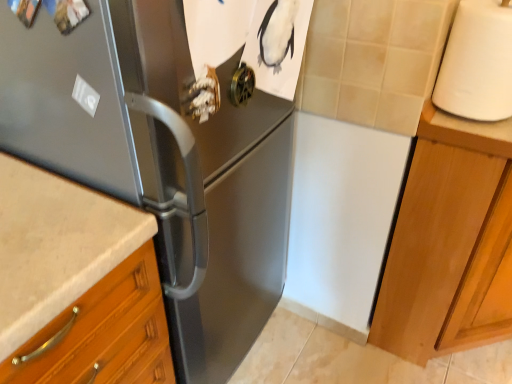
Question: From the image's perspective, is satin black refrigerator at left over light wood cabinet at right?

Choices:
 (A) yes
 (B) no

Answer: (A)

Question: Can you confirm if satin black refrigerator at left is bigger than light wood cabinet at right?

Choices:
 (A) no
 (B) yes

Answer: (B)

Question: Can you confirm if satin black refrigerator at left is wider than light wood cabinet at right?

Choices:
 (A) no
 (B) yes

Answer: (B)

Question: Considering the relative sizes of satin black refrigerator at left and light wood cabinet at right in the image provided, is satin black refrigerator at left thinner than light wood cabinet at right?

Choices:
 (A) no
 (B) yes

Answer: (A)

Question: Is the position of satin black refrigerator at left more distant than that of light wood cabinet at right?

Choices:
 (A) yes
 (B) no

Answer: (B)

Question: Considering the relative positions of light wood cabinet at right and white matte countertop at right in the image provided, is light wood cabinet at right to the left or to the right of white matte countertop at right?

Choices:
 (A) right
 (B) left

Answer: (A)

Question: Looking at their shapes, would you say light wood cabinet at right is wider or thinner than white matte countertop at right?

Choices:
 (A) thin
 (B) wide

Answer: (B)

Question: Based on their sizes in the image, would you say light wood cabinet at right is bigger or smaller than white matte countertop at right?

Choices:
 (A) big
 (B) small

Answer: (A)

Question: From a real-world perspective, is light wood cabinet at right positioned above or below white matte countertop at right?

Choices:
 (A) below
 (B) above

Answer: (A)

Question: In terms of height, does white matte paper towel at right look taller or shorter compared to light wood cabinet at right?

Choices:
 (A) short
 (B) tall

Answer: (A)

Question: Considering their positions, is white matte paper towel at right located in front of or behind light wood cabinet at right?

Choices:
 (A) behind
 (B) front

Answer: (B)

Question: Is white matte paper towel at right to the left or to the right of light wood cabinet at right in the image?

Choices:
 (A) left
 (B) right

Answer: (A)

Question: Based on their sizes in the image, would you say white matte paper towel at right is bigger or smaller than light wood cabinet at right?

Choices:
 (A) big
 (B) small

Answer: (B)

Question: From a real-world perspective, relative to white matte countertop at right, is white matte paper towel at right vertically above or below?

Choices:
 (A) below
 (B) above

Answer: (B)

Question: In terms of width, does white matte paper towel at right look wider or thinner when compared to white matte countertop at right?

Choices:
 (A) thin
 (B) wide

Answer: (A)